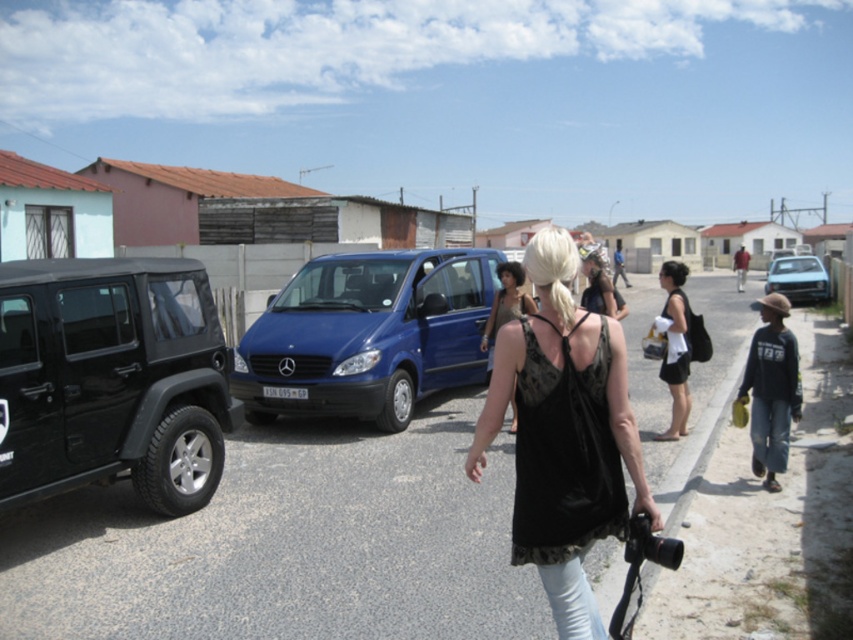
Does matte black dress at center have a greater height compared to blue metallic sedan at right?

No.

Does matte black dress at center have a smaller size compared to blue metallic sedan at right?

Yes, matte black dress at center is smaller than blue metallic sedan at right.

Locate an element on the screen. Image resolution: width=853 pixels, height=640 pixels. matte black dress at center is located at coordinates (505, 305).

Where is `matte black dress at center`? matte black dress at center is located at coordinates (505, 305).

Does shiny black jeep at left have a lesser height compared to matte black dress at center?

Incorrect, shiny black jeep at left's height does not fall short of matte black dress at center's.

From the picture: Can you confirm if shiny black jeep at left is positioned below matte black dress at center?

Correct, shiny black jeep at left is located below matte black dress at center.

I want to click on shiny black jeep at left, so [111, 380].

Does black fabric dress at center appear under blue metallic sedan at right?

Incorrect, black fabric dress at center is not positioned below blue metallic sedan at right.

Consider the image. Does black fabric dress at center appear over blue metallic sedan at right?

Correct, black fabric dress at center is located above blue metallic sedan at right.

Locate an element on the screen. This screenshot has height=640, width=853. black fabric dress at center is located at coordinates (674, 348).